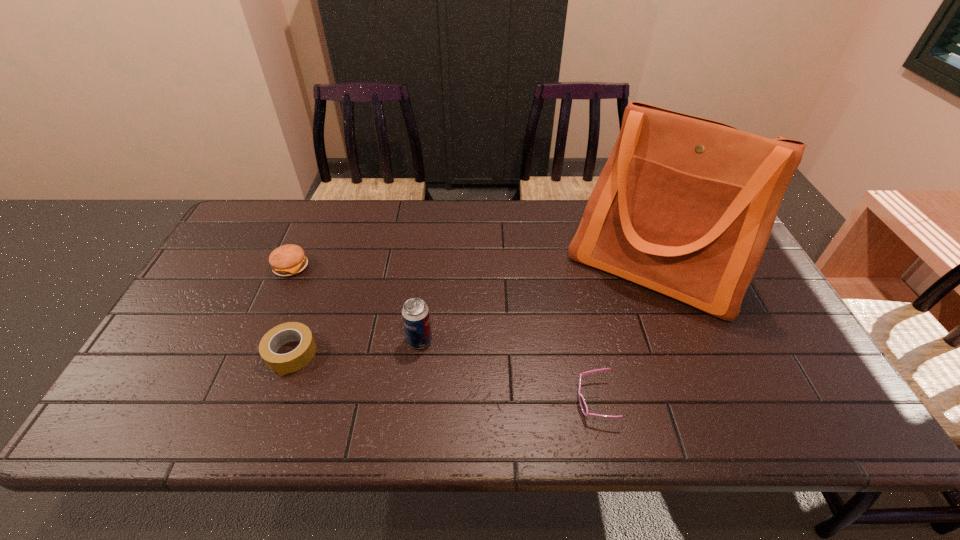
What are the coordinates of `free space at the right edge of the desktop` in the screenshot? It's located at (753, 316).

In order to click on vacant region at the far left corner in this screenshot , I will do `click(259, 213)`.

Identify the location of free space that is in between the hamburger and the duct tape. The width and height of the screenshot is (960, 540). (291, 310).

Where is `free space between the third tallest object and the shopping bag`? Image resolution: width=960 pixels, height=540 pixels. free space between the third tallest object and the shopping bag is located at coordinates (473, 267).

The image size is (960, 540). Find the location of `free spot between the duct tape and the nearest object`. free spot between the duct tape and the nearest object is located at coordinates (443, 377).

Locate an element on the screen. Image resolution: width=960 pixels, height=540 pixels. vacant point located between the sunglasses and the third shortest object is located at coordinates (443, 334).

The height and width of the screenshot is (540, 960). In order to click on free space between the fourth shortest object and the sunglasses in this screenshot , I will do (x=507, y=370).

You are a GUI agent. You are given a task and a screenshot of the screen. Output one action in this format:
    pyautogui.click(x=<x>, y=<y>)
    Task: Click on the empty space between the tallest object and the beer can
    This screenshot has width=960, height=540.
    Given the screenshot: What is the action you would take?
    pyautogui.click(x=538, y=303)

Find the location of a particular element. vacant point located between the nearest object and the shopping bag is located at coordinates (625, 334).

This screenshot has height=540, width=960. Find the location of `vacant area that lies between the tallest object and the nearest object`. vacant area that lies between the tallest object and the nearest object is located at coordinates (625, 334).